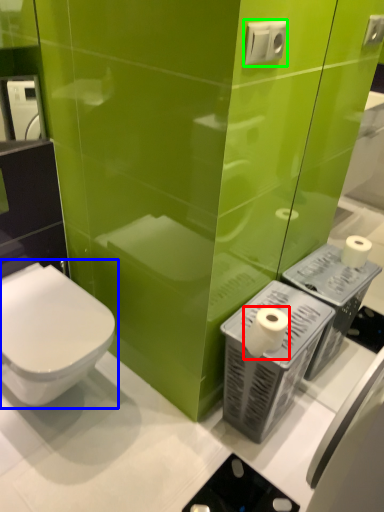
Question: Based on their relative distances, which object is nearer to toilet paper (highlighted by a red box)? Choose from toilet (highlighted by a blue box) and electric outlet (highlighted by a green box).

Choices:
 (A) toilet
 (B) electric outlet

Answer: (A)